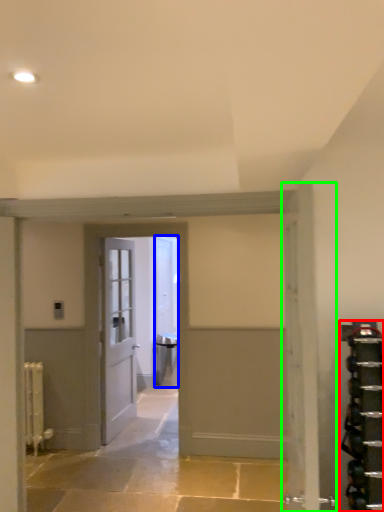
Question: Which object is positioned closest to shelf (highlighted by a red box)? Select from door (highlighted by a blue box) and door (highlighted by a green box).

Choices:
 (A) door
 (B) door

Answer: (B)